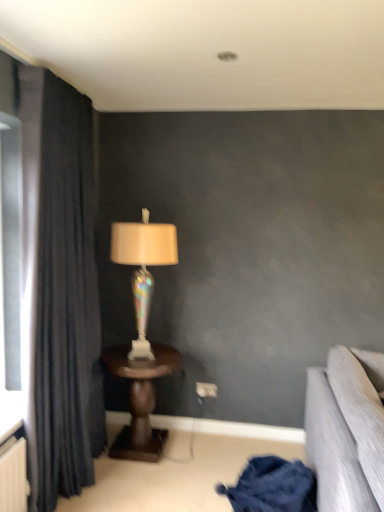
Question: In terms of size, does wooden table at center appear bigger or smaller than iridescent glass lamp at center?

Choices:
 (A) small
 (B) big

Answer: (B)

Question: In the image, is wooden table at center positioned in front of or behind iridescent glass lamp at center?

Choices:
 (A) behind
 (B) front

Answer: (B)

Question: Which of these objects is positioned farthest from the dark fabric curtain at left?

Choices:
 (A) iridescent glass lamp at center
 (B) wooden table at center
 (C) dark blue fabric at lower right

Answer: (C)

Question: Which object is the closest to the wooden table at center?

Choices:
 (A) iridescent glass lamp at center
 (B) dark fabric curtain at left
 (C) dark blue fabric at lower right

Answer: (A)